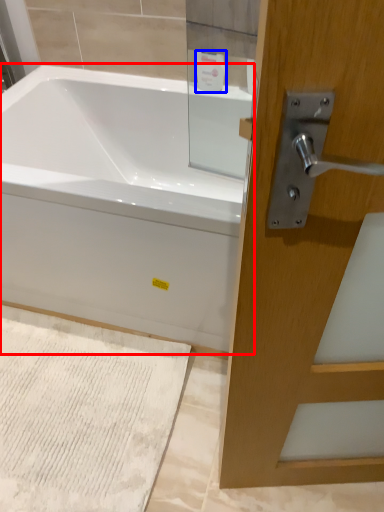
Question: Among these objects, which one is farthest to the camera, bathtub (highlighted by a red box) or toiletry (highlighted by a blue box)?

Choices:
 (A) bathtub
 (B) toiletry

Answer: (B)